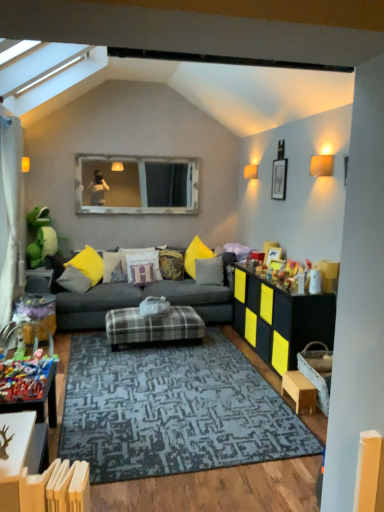
Question: Is wooden table at lower left, the fourth table when ordered from back to front, looking in the opposite direction of matte black cabinet at right, which appears as the 3th table when viewed from the front?

Choices:
 (A) yes
 (B) no

Answer: (B)

Question: Is wooden table at lower left, the fourth table when ordered from back to front, not inside matte black cabinet at right, which appears as the 4th table when viewed from the left?

Choices:
 (A) no
 (B) yes

Answer: (B)

Question: Can you confirm if wooden table at lower left, the first table when ordered from left to right, is positioned to the right of matte black cabinet at right, which appears as the 4th table when viewed from the left?

Choices:
 (A) yes
 (B) no

Answer: (B)

Question: Considering the relative sizes of wooden table at lower left, positioned as the 1th table in front-to-back order, and matte black cabinet at right, which appears as the 4th table when viewed from the left, in the image provided, is wooden table at lower left, positioned as the 1th table in front-to-back order, smaller than matte black cabinet at right, which appears as the 4th table when viewed from the left,?

Choices:
 (A) yes
 (B) no

Answer: (A)

Question: From a real-world perspective, is wooden table at lower left, the 4th table positioned from the right, on top of matte black cabinet at right, acting as the 2th table starting from the back?

Choices:
 (A) no
 (B) yes

Answer: (B)

Question: Is textured yellow pillow at center, which is counted as the second pillow, starting from the right, in front of or behind white fabric curtain at left in the image?

Choices:
 (A) behind
 (B) front

Answer: (A)

Question: Looking at the image, does textured yellow pillow at center, positioned as the 5th pillow in left-to-right order, seem bigger or smaller compared to white fabric curtain at left?

Choices:
 (A) small
 (B) big

Answer: (A)

Question: From their relative heights in the image, would you say textured yellow pillow at center, which is counted as the second pillow, starting from the right, is taller or shorter than white fabric curtain at left?

Choices:
 (A) tall
 (B) short

Answer: (B)

Question: Do you think textured yellow pillow at center, which is counted as the second pillow, starting from the right, is within white fabric curtain at left, or outside of it?

Choices:
 (A) inside
 (B) outside

Answer: (B)

Question: From the image's perspective, is plaid fabric ottoman at center, which is the 3th table in right-to-left order, positioned above or below yellow fabric pillow at center, acting as the sixth pillow starting from the right?

Choices:
 (A) above
 (B) below

Answer: (B)

Question: In terms of size, does plaid fabric ottoman at center, the first table positioned from the back, appear bigger or smaller than yellow fabric pillow at center, acting as the sixth pillow starting from the right?

Choices:
 (A) small
 (B) big

Answer: (B)

Question: Based on their positions, is plaid fabric ottoman at center, placed as the 2th table when sorted from left to right, located to the left or right of yellow fabric pillow at center, acting as the sixth pillow starting from the right?

Choices:
 (A) right
 (B) left

Answer: (A)

Question: In terms of height, does plaid fabric ottoman at center, which is the 3th table in right-to-left order, look taller or shorter compared to yellow fabric pillow at center, acting as the sixth pillow starting from the right?

Choices:
 (A) short
 (B) tall

Answer: (A)

Question: Based on their positions, is wooden-framed mirror at upper center located to the left or right of purple velvet pillow at center, placed as the 3th pillow when sorted from right to left?

Choices:
 (A) right
 (B) left

Answer: (B)

Question: Would you say wooden-framed mirror at upper center is inside or outside purple velvet pillow at center, which is counted as the 4th pillow, starting from the left?

Choices:
 (A) inside
 (B) outside

Answer: (B)